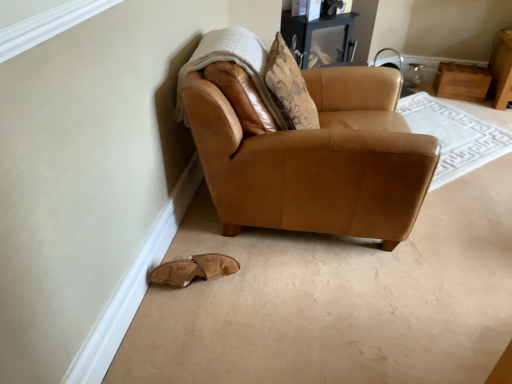
What do you see at coordinates (323, 38) in the screenshot?
I see `matte black entertainment center at upper center` at bounding box center [323, 38].

What do you see at coordinates (194, 269) in the screenshot? I see `tan suede slipper at lower left` at bounding box center [194, 269].

Where is `matte black entertainment center at upper center`? Image resolution: width=512 pixels, height=384 pixels. matte black entertainment center at upper center is located at coordinates [x=323, y=38].

From a real-world perspective, is white textured blanket at upper left above or below tan suede slipper at lower left?

white textured blanket at upper left is situated higher than tan suede slipper at lower left in the real world.

Which object is further away from the camera, white textured blanket at upper left or tan suede slipper at lower left?

tan suede slipper at lower left.

Is white textured blanket at upper left positioned far away from tan suede slipper at lower left?

white textured blanket at upper left is near tan suede slipper at lower left, not far away.

Between point (244, 67) and point (230, 258), which one is positioned behind?

The point (230, 258) is farther from the camera.

Who is smaller, white textured blanket at upper left or matte black entertainment center at upper center?

With smaller size is matte black entertainment center at upper center.

Does white textured blanket at upper left touch matte black entertainment center at upper center?

white textured blanket at upper left and matte black entertainment center at upper center are clearly separated.

Is white textured blanket at upper left aimed at matte black entertainment center at upper center?

No, white textured blanket at upper left is not aimed at matte black entertainment center at upper center.

From the image's perspective, is white textured blanket at upper left positioned above or below matte black entertainment center at upper center?

From the image's perspective, white textured blanket at upper left appears below matte black entertainment center at upper center.

Is matte black entertainment center at upper center further to camera compared to tan suede slipper at lower left?

Yes, it is.

Considering the sizes of matte black entertainment center at upper center and tan suede slipper at lower left in the image, is matte black entertainment center at upper center taller or shorter than tan suede slipper at lower left?

Clearly, matte black entertainment center at upper center is taller compared to tan suede slipper at lower left.

Which point is more distant from viewer, (x=311, y=26) or (x=225, y=261)?

The point (x=311, y=26) is behind.

How different are the orientations of matte black entertainment center at upper center and tan suede slipper at lower left in degrees?

60.2 degrees.

Between saddle brown leather armchair at lower left and white textured blanket at upper left, which one has less height?

white textured blanket at upper left.

Is saddle brown leather armchair at lower left inside the boundaries of white textured blanket at upper left, or outside?

saddle brown leather armchair at lower left is spatially situated outside white textured blanket at upper left.

In the scene shown: Is saddle brown leather armchair at lower left looking in the opposite direction of white textured blanket at upper left?

That's right, saddle brown leather armchair at lower left is facing away from white textured blanket at upper left.

From a real-world perspective, who is located higher, saddle brown leather armchair at lower left or white textured blanket at upper left?

white textured blanket at upper left, from a real-world perspective.

Looking at this image, considering the relative positions of tan suede slipper at lower left and white textured blanket at upper left in the image provided, is tan suede slipper at lower left in front of white textured blanket at upper left?

That is False.

From the picture: Considering the relative sizes of tan suede slipper at lower left and white textured blanket at upper left in the image provided, is tan suede slipper at lower left shorter than white textured blanket at upper left?

Indeed, tan suede slipper at lower left has a lesser height compared to white textured blanket at upper left.

Considering the positions of points (192, 269) and (247, 32), is point (192, 269) closer to camera compared to point (247, 32)?

That is True.

Is tan suede slipper at lower left surrounding white textured blanket at upper left?

No, white textured blanket at upper left is not surrounded by tan suede slipper at lower left.

Is tan suede slipper at lower left not near saddle brown leather armchair at lower left?

They are positioned close to each other.

Is tan suede slipper at lower left positioned with its back to saddle brown leather armchair at lower left?

No, saddle brown leather armchair at lower left is not at the back of tan suede slipper at lower left.

Which is farther from the camera, (170, 267) or (191, 127)?

The point (170, 267) is more distant.

Based on the photo, is saddle brown leather armchair at lower left thinner than tan suede slipper at lower left?

In fact, saddle brown leather armchair at lower left might be wider than tan suede slipper at lower left.

Based on the photo, is saddle brown leather armchair at lower left facing towards tan suede slipper at lower left?

No, saddle brown leather armchair at lower left is not turned towards tan suede slipper at lower left.

Would you say saddle brown leather armchair at lower left is inside or outside tan suede slipper at lower left?

saddle brown leather armchair at lower left is spatially situated outside tan suede slipper at lower left.

From the image's perspective, is saddle brown leather armchair at lower left beneath tan suede slipper at lower left?

Incorrect, from the image's perspective, saddle brown leather armchair at lower left is higher than tan suede slipper at lower left.

Where is `footwear on the left of white textured blanket at upper left`? footwear on the left of white textured blanket at upper left is located at coordinates (194, 269).

Where is `blanket located in front of the matte black entertainment center at upper center`? blanket located in front of the matte black entertainment center at upper center is located at coordinates (234, 63).

Based on their spatial positions, is saddle brown leather armchair at lower left or tan suede slipper at lower left closer to white textured blanket at upper left?

saddle brown leather armchair at lower left is positioned closer to the anchor white textured blanket at upper left.

From the image, which object appears to be farther from saddle brown leather armchair at lower left, matte black entertainment center at upper center or tan suede slipper at lower left?

matte black entertainment center at upper center is further to saddle brown leather armchair at lower left.

Which object lies nearer to the anchor point tan suede slipper at lower left, white textured blanket at upper left or saddle brown leather armchair at lower left?

saddle brown leather armchair at lower left is positioned closer to the anchor tan suede slipper at lower left.

Which object lies further to the anchor point white textured blanket at upper left, matte black entertainment center at upper center or saddle brown leather armchair at lower left?

matte black entertainment center at upper center.

Estimate the real-world distances between objects in this image. Which object is further from white textured blanket at upper left, tan suede slipper at lower left or saddle brown leather armchair at lower left?

Based on the image, tan suede slipper at lower left appears to be further to white textured blanket at upper left.

Which object lies nearer to the anchor point matte black entertainment center at upper center, white textured blanket at upper left or tan suede slipper at lower left?

white textured blanket at upper left is positioned closer to the anchor matte black entertainment center at upper center.

Based on their spatial positions, is white textured blanket at upper left or matte black entertainment center at upper center further from tan suede slipper at lower left?

matte black entertainment center at upper center.

From the image, which object appears to be nearer to saddle brown leather armchair at lower left, white textured blanket at upper left or tan suede slipper at lower left?

The object closer to saddle brown leather armchair at lower left is white textured blanket at upper left.

You are a GUI agent. You are given a task and a screenshot of the screen. Output one action in this format:
    pyautogui.click(x=<x>, y=<y>)
    Task: Click on the blanket between matte black entertainment center at upper center and tan suede slipper at lower left from top to bottom
    
    Given the screenshot: What is the action you would take?
    pyautogui.click(x=234, y=63)

Find the location of a particular element. The width and height of the screenshot is (512, 384). chair between white textured blanket at upper left and tan suede slipper at lower left vertically is located at coordinates (311, 154).

Identify the location of blanket between saddle brown leather armchair at lower left and matte black entertainment center at upper center from front to back. The width and height of the screenshot is (512, 384). (234, 63).

Identify the location of chair between matte black entertainment center at upper center and tan suede slipper at lower left in the vertical direction. (311, 154).